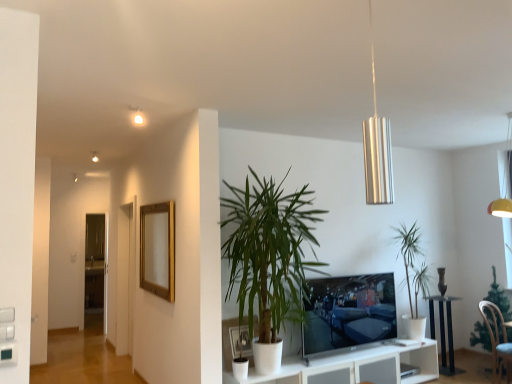
Describe the element at coordinates (240, 341) in the screenshot. Image resolution: width=512 pixels, height=384 pixels. I see `white matte picture frame at lower center, placed as the 1th picture frame when sorted from right to left` at that location.

This screenshot has height=384, width=512. What do you see at coordinates (499, 297) in the screenshot?
I see `green leafy plant at lower right, acting as the first houseplant starting from the right` at bounding box center [499, 297].

Where is `green leafy plant at lower right, acting as the 3th houseplant starting from the left`? The image size is (512, 384). green leafy plant at lower right, acting as the 3th houseplant starting from the left is located at coordinates (499, 297).

Find the location of a particular element. This screenshot has width=512, height=384. green leafy plant at center, which is the second houseplant from right to left is located at coordinates (414, 276).

Measure the distance between point (433, 310) and camera.

Point (433, 310) is 5.17 meters away from camera.

What are the coordinates of `green leafy plant at center, positioned as the third houseplant in right-to-left order` in the screenshot? It's located at (269, 252).

The image size is (512, 384). Describe the element at coordinates (377, 149) in the screenshot. I see `silver metallic pendant light at upper center` at that location.

Identify the location of gold wooden picture frame at upper left, positioned as the first picture frame in top-to-bottom order. (158, 249).

The image size is (512, 384). Find the location of `white matte picture frame at lower center, placed as the 1th picture frame when sorted from right to left`. white matte picture frame at lower center, placed as the 1th picture frame when sorted from right to left is located at coordinates (240, 341).

Based on the photo, from their relative heights in the image, would you say green leafy plant at center, which is the second houseplant from right to left, is taller or shorter than transparent glass door at left?

Considering their sizes, green leafy plant at center, which is the second houseplant from right to left, has less height than transparent glass door at left.

From a real-world perspective, is green leafy plant at center, which is the second houseplant from right to left, positioned over transparent glass door at left based on gravity?

No, from a real-world perspective, green leafy plant at center, which is the second houseplant from right to left, is not above transparent glass door at left.

In the image, is green leafy plant at center, which is the second houseplant in left-to-right order, positioned in front of or behind transparent glass door at left?

Visually, green leafy plant at center, which is the second houseplant in left-to-right order, is located in front of transparent glass door at left.

From the image's perspective, which houseplant is the 1st one above the transparent glass door at left? Please provide its 2D coordinates.

[(414, 276)]

Is silver metallic pendant light at upper center facing towards green leafy plant at lower right, acting as the first houseplant starting from the right?

No.

From their relative heights in the image, would you say silver metallic pendant light at upper center is taller or shorter than green leafy plant at lower right, acting as the 3th houseplant starting from the left?

In the image, silver metallic pendant light at upper center appears to be shorter than green leafy plant at lower right, acting as the 3th houseplant starting from the left.

From a real-world perspective, is silver metallic pendant light at upper center below green leafy plant at lower right, acting as the first houseplant starting from the right?

Incorrect, from a real-world perspective, silver metallic pendant light at upper center is higher than green leafy plant at lower right, acting as the first houseplant starting from the right.

From a real-world perspective, is transparent glass door at left located beneath black glossy table at lower right?

Incorrect, from a real-world perspective, transparent glass door at left is higher than black glossy table at lower right.

Does transparent glass door at left turn towards black glossy table at lower right?

No, transparent glass door at left does not turn towards black glossy table at lower right.

Which of these two, transparent glass door at left or black glossy table at lower right, is wider?

Wider between the two is black glossy table at lower right.

Which object is further away from the camera, light blue fabric chair at lower right or green leafy plant at lower right, acting as the first houseplant starting from the right?

green leafy plant at lower right, acting as the first houseplant starting from the right.

Identify the location of chair below the green leafy plant at lower right, acting as the 3th houseplant starting from the left (from the image's perspective). The height and width of the screenshot is (384, 512). (497, 340).

Based on the photo, which of these two, light blue fabric chair at lower right or green leafy plant at lower right, acting as the 3th houseplant starting from the left, stands shorter?

Standing shorter between the two is light blue fabric chair at lower right.

Which object is positioned more to the left, light blue fabric chair at lower right or green leafy plant at lower right, acting as the 3th houseplant starting from the left?

light blue fabric chair at lower right is more to the left.

From a real-world perspective, is gold wooden picture frame at upper left, marked as the first picture frame in a back-to-front arrangement, above or below green leafy plant at center, which appears as the first houseplant when viewed from the left?

gold wooden picture frame at upper left, marked as the first picture frame in a back-to-front arrangement, is situated higher than green leafy plant at center, which appears as the first houseplant when viewed from the left, in the real world.

Is green leafy plant at center, positioned as the third houseplant in right-to-left order, at the back of gold wooden picture frame at upper left, the second picture frame positioned from the bottom?

gold wooden picture frame at upper left, the second picture frame positioned from the bottom, does not have its back to green leafy plant at center, positioned as the third houseplant in right-to-left order.

Which of these two, gold wooden picture frame at upper left, positioned as the first picture frame in top-to-bottom order, or green leafy plant at center, which appears as the first houseplant when viewed from the left, is thinner?

With smaller width is gold wooden picture frame at upper left, positioned as the first picture frame in top-to-bottom order.

Is gold wooden picture frame at upper left, arranged as the second picture frame when viewed from the right, positioned in front of green leafy plant at center, positioned as the third houseplant in right-to-left order?

No, gold wooden picture frame at upper left, arranged as the second picture frame when viewed from the right, is further to the viewer.

Consider the image. Is green leafy plant at center, which is the second houseplant from right to left, oriented away from black glossy table at lower right?

No.

From the image's perspective, would you say green leafy plant at center, which is the second houseplant from right to left, is positioned over black glossy table at lower right?

Correct, green leafy plant at center, which is the second houseplant from right to left, appears higher than black glossy table at lower right in the image.

Measure the distance between green leafy plant at center, which is the second houseplant from right to left, and black glossy table at lower right.

green leafy plant at center, which is the second houseplant from right to left, is 18.37 inches away from black glossy table at lower right.

From a real-world perspective, between green leafy plant at center, which is the second houseplant in left-to-right order, and black glossy table at lower right, who is vertically lower?

black glossy table at lower right is physically lower.

From the image's perspective, between green leafy plant at center, which appears as the first houseplant when viewed from the left, and transparent glass door at left, who is located below?

transparent glass door at left, from the image's perspective.

Choose the correct answer: Is green leafy plant at center, positioned as the third houseplant in right-to-left order, inside transparent glass door at left or outside it?

green leafy plant at center, positioned as the third houseplant in right-to-left order, is located beyond the bounds of transparent glass door at left.

Based on their sizes in the image, would you say green leafy plant at center, which appears as the first houseplant when viewed from the left, is bigger or smaller than transparent glass door at left?

Clearly, green leafy plant at center, which appears as the first houseplant when viewed from the left, is larger in size than transparent glass door at left.

In order to click on glass door that is on the left side of green leafy plant at center, which is the second houseplant from right to left in this screenshot , I will do `click(96, 263)`.

Find the location of `lamp above the green leafy plant at lower right, acting as the 3th houseplant starting from the left (from a real-world perspective)`. lamp above the green leafy plant at lower right, acting as the 3th houseplant starting from the left (from a real-world perspective) is located at coordinates (377, 149).

Estimate the real-world distances between objects in this image. Which object is further from gold wooden picture frame at upper left, arranged as the second picture frame when viewed from the right, green leafy plant at center, which is the second houseplant from right to left, or green leafy plant at center, positioned as the third houseplant in right-to-left order?

green leafy plant at center, which is the second houseplant from right to left, is further to gold wooden picture frame at upper left, arranged as the second picture frame when viewed from the right.

When comparing their distances from black glossy table at lower right, does gold wooden picture frame at upper left, arranged as the second picture frame when viewed from the right, or green leafy plant at center, which appears as the first houseplant when viewed from the left, seem closer?

green leafy plant at center, which appears as the first houseplant when viewed from the left, lies closer to black glossy table at lower right than the other object.

Which object lies nearer to the anchor point light blue fabric chair at lower right, flat screen tv at center or gold wooden picture frame at upper left, which is the second picture frame from front to back?

Among the two, flat screen tv at center is located nearer to light blue fabric chair at lower right.

Considering their positions, is gold wooden picture frame at upper left, the second picture frame positioned from the bottom, positioned closer to white matte picture frame at lower center, arranged as the 2th picture frame when viewed from the left, than light blue fabric chair at lower right?

gold wooden picture frame at upper left, the second picture frame positioned from the bottom, is positioned closer to the anchor white matte picture frame at lower center, arranged as the 2th picture frame when viewed from the left.

When comparing their distances from white matte picture frame at lower center, the 2th picture frame positioned from the back, does green leafy plant at lower right, acting as the first houseplant starting from the right, or transparent glass door at left seem further?

transparent glass door at left is further to white matte picture frame at lower center, the 2th picture frame positioned from the back.

Based on their spatial positions, is green leafy plant at center, which is the second houseplant in left-to-right order, or green leafy plant at center, positioned as the third houseplant in right-to-left order, closer to green leafy plant at lower right, acting as the first houseplant starting from the right?

green leafy plant at center, which is the second houseplant in left-to-right order.

From the image, which object appears to be farther from green leafy plant at center, which is the second houseplant in left-to-right order, black glossy table at lower right or green leafy plant at lower right, acting as the first houseplant starting from the right?

green leafy plant at lower right, acting as the first houseplant starting from the right.

Estimate the real-world distances between objects in this image. Which object is further from black glossy table at lower right, transparent glass door at left or flat screen tv at center?

Among the two, transparent glass door at left is located further to black glossy table at lower right.

The image size is (512, 384). Find the location of `picture frame between gold wooden picture frame at upper left, placed as the first picture frame when sorted from left to right, and green leafy plant at lower right, acting as the 3th houseplant starting from the left, from left to right`. picture frame between gold wooden picture frame at upper left, placed as the first picture frame when sorted from left to right, and green leafy plant at lower right, acting as the 3th houseplant starting from the left, from left to right is located at coordinates (240, 341).

I want to click on television situated between transparent glass door at left and light blue fabric chair at lower right from left to right, so click(x=348, y=312).

Locate an element on the screen. The image size is (512, 384). picture frame situated between gold wooden picture frame at upper left, which is the second picture frame from front to back, and green leafy plant at center, which is the second houseplant from right to left, from left to right is located at coordinates (240, 341).

This screenshot has height=384, width=512. I want to click on table between flat screen tv at center and green leafy plant at lower right, acting as the 3th houseplant starting from the left, from left to right, so click(x=444, y=333).